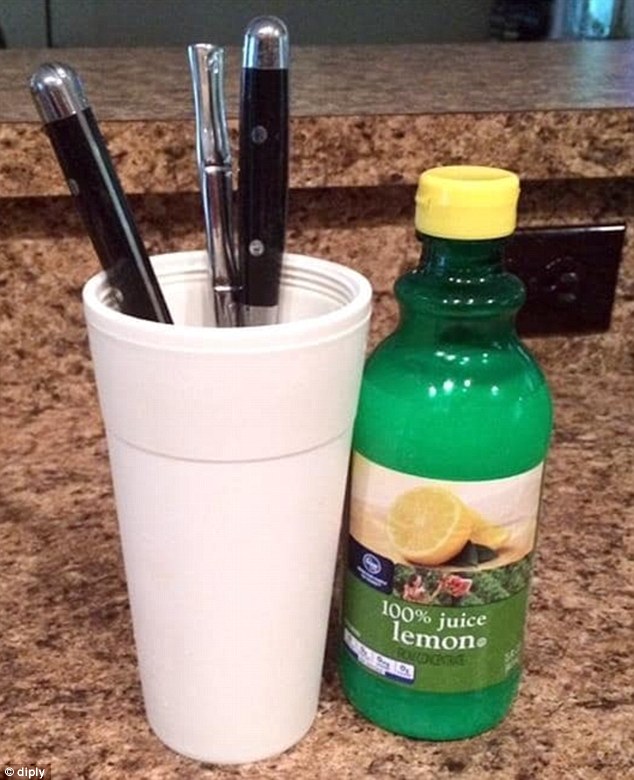
This screenshot has width=634, height=780. I want to click on granite counter, so click(588, 625).